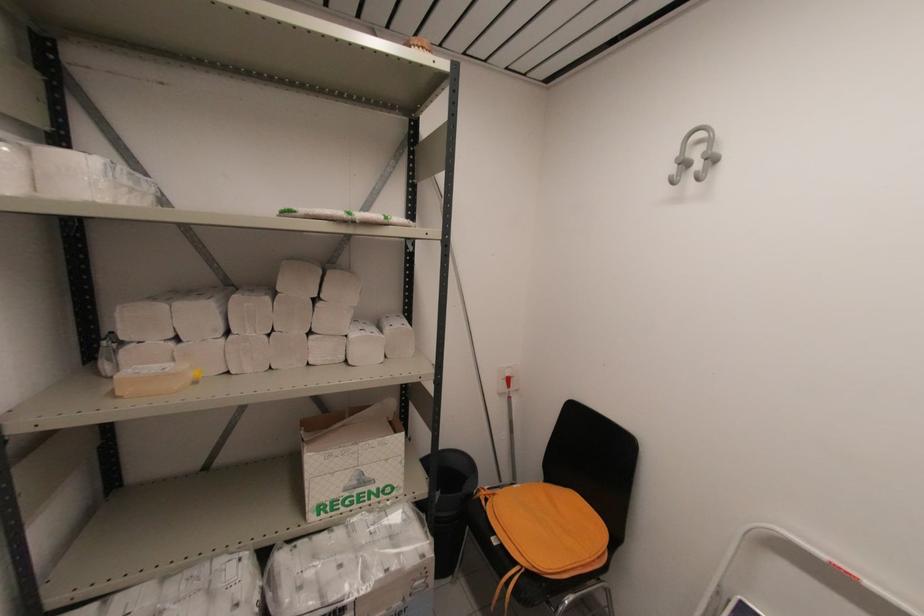
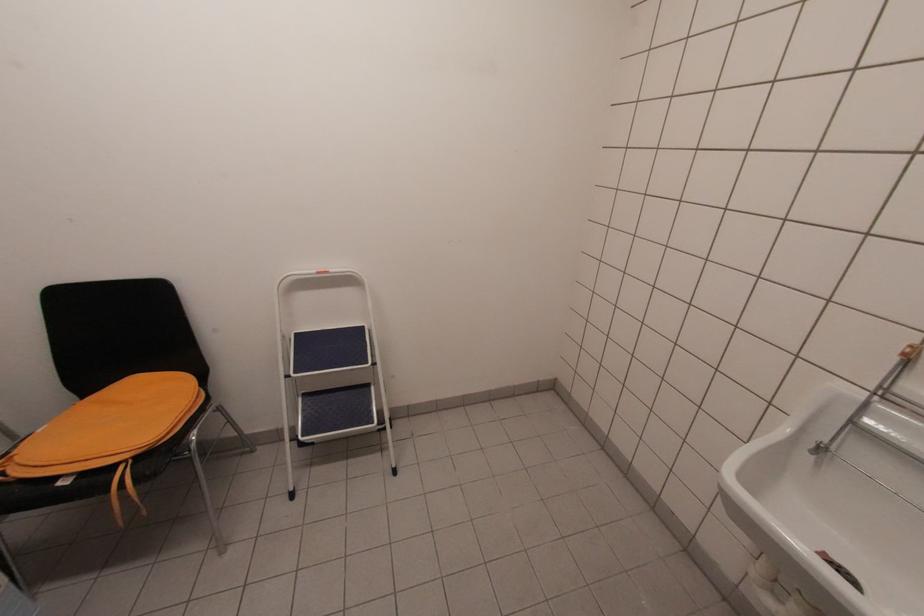
The first image is from the beginning of the video and the second image is from the end. How did the camera likely rotate when shooting the video?

The camera rotated toward right-down.